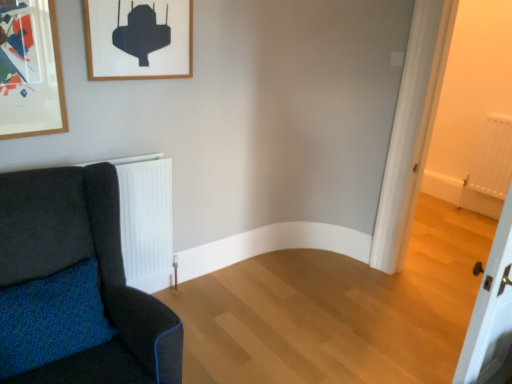
You are a GUI agent. You are given a task and a screenshot of the screen. Output one action in this format:
    pyautogui.click(x=<x>, y=<y>)
    Task: Click on the wooden picture frame at upper left
    
    Given the screenshot: What is the action you would take?
    pyautogui.click(x=138, y=39)

This screenshot has width=512, height=384. What do you see at coordinates (493, 158) in the screenshot? I see `white matte radiator at right` at bounding box center [493, 158].

Where is `white matte radiator at right`? This screenshot has height=384, width=512. white matte radiator at right is located at coordinates (493, 158).

Where is `wooden picture frame at upper left`? The width and height of the screenshot is (512, 384). wooden picture frame at upper left is located at coordinates (138, 39).

Is there a large distance between velvet dark blue sofa at left and white matte radiator at right?

Indeed, velvet dark blue sofa at left is not near white matte radiator at right.

Between velvet dark blue sofa at left and white matte radiator at right, which one has less height?

With less height is velvet dark blue sofa at left.

Image resolution: width=512 pixels, height=384 pixels. What are the coordinates of `radiator above the velvet dark blue sofa at left (from the image's perspective)` in the screenshot? It's located at (493, 158).

From the image's perspective, would you say velvet dark blue sofa at left is positioned over white matte radiator at right?

No, from the image's perspective, velvet dark blue sofa at left is not on top of white matte radiator at right.

Which object is more forward, wooden picture frame at upper left or white matte radiator at right?

wooden picture frame at upper left is more forward.

Is wooden picture frame at upper left aimed at white matte radiator at right?

No, wooden picture frame at upper left is not turned towards white matte radiator at right.

In terms of width, does wooden picture frame at upper left look wider or thinner when compared to white matte radiator at right?

Clearly, wooden picture frame at upper left has less width compared to white matte radiator at right.

From a real-world perspective, who is located higher, wooden picture frame at upper left or white matte radiator at right?

wooden picture frame at upper left is physically above.

Between point (478, 145) and point (153, 373), which one is positioned in front?

The point (153, 373) is more forward.

From the picture: Considering the relative positions of white matte radiator at right and velvet dark blue sofa at left in the image provided, is white matte radiator at right to the right of velvet dark blue sofa at left from the viewer's perspective?

Correct, you'll find white matte radiator at right to the right of velvet dark blue sofa at left.

Is white matte radiator at right taller or shorter than velvet dark blue sofa at left?

white matte radiator at right is taller than velvet dark blue sofa at left.

Would you say white matte radiator at right is outside velvet dark blue sofa at left?

white matte radiator at right lies outside velvet dark blue sofa at left's area.

From the image's perspective, would you say white matte radiator at right is shown under wooden picture frame at upper left?

Yes.

Which of these two, white matte radiator at right or wooden picture frame at upper left, stands shorter?

Standing shorter between the two is wooden picture frame at upper left.

Can you confirm if white matte radiator at right is wider than wooden picture frame at upper left?

Correct, the width of white matte radiator at right exceeds that of wooden picture frame at upper left.

Which is more to the left, white matte radiator at right or wooden picture frame at upper left?

Positioned to the left is wooden picture frame at upper left.

Considering the points (5, 277) and (154, 68), which point is behind, point (5, 277) or point (154, 68)?

The point (154, 68) is farther.

Considering the sizes of objects velvet dark blue sofa at left and wooden picture frame at upper left in the image provided, who is smaller, velvet dark blue sofa at left or wooden picture frame at upper left?

wooden picture frame at upper left.

Is velvet dark blue sofa at left positioned far away from wooden picture frame at upper left?

They are positioned close to each other.

Is wooden picture frame at upper left facing towards velvet dark blue sofa at left?

No.

Considering the relative sizes of wooden picture frame at upper left and velvet dark blue sofa at left in the image provided, is wooden picture frame at upper left bigger than velvet dark blue sofa at left?

No, wooden picture frame at upper left is not bigger than velvet dark blue sofa at left.

How different are the orientations of wooden picture frame at upper left and velvet dark blue sofa at left in degrees?

The facing directions of wooden picture frame at upper left and velvet dark blue sofa at left are 0.377 degrees apart.

Considering the points (123, 43) and (33, 206), which point is behind, point (123, 43) or point (33, 206)?

The point (123, 43) is farther.

Identify the location of chair directly beneath the white matte radiator at right (from a real-world perspective). (98, 273).

Identify the location of radiator located below the wooden picture frame at upper left (from the image's perspective). (493, 158).

Looking at the image, which one is located closer to white matte radiator at right, velvet dark blue sofa at left or wooden picture frame at upper left?

wooden picture frame at upper left is positioned closer to the anchor white matte radiator at right.

Based on their spatial positions, is wooden picture frame at upper left or white matte radiator at right closer to velvet dark blue sofa at left?

The object closer to velvet dark blue sofa at left is wooden picture frame at upper left.

From the image, which object appears to be farther from velvet dark blue sofa at left, white matte radiator at right or wooden picture frame at upper left?

The object further to velvet dark blue sofa at left is white matte radiator at right.

When comparing their distances from white matte radiator at right, does wooden picture frame at upper left or velvet dark blue sofa at left seem further?

velvet dark blue sofa at left.

Looking at the image, which one is located further to wooden picture frame at upper left, white matte radiator at right or velvet dark blue sofa at left?

Among the two, white matte radiator at right is located further to wooden picture frame at upper left.

When comparing their distances from wooden picture frame at upper left, does velvet dark blue sofa at left or white matte radiator at right seem closer?

velvet dark blue sofa at left lies closer to wooden picture frame at upper left than the other object.

Find the location of a particular element. Image resolution: width=512 pixels, height=384 pixels. picture frame between velvet dark blue sofa at left and white matte radiator at right in the horizontal direction is located at coordinates (138, 39).